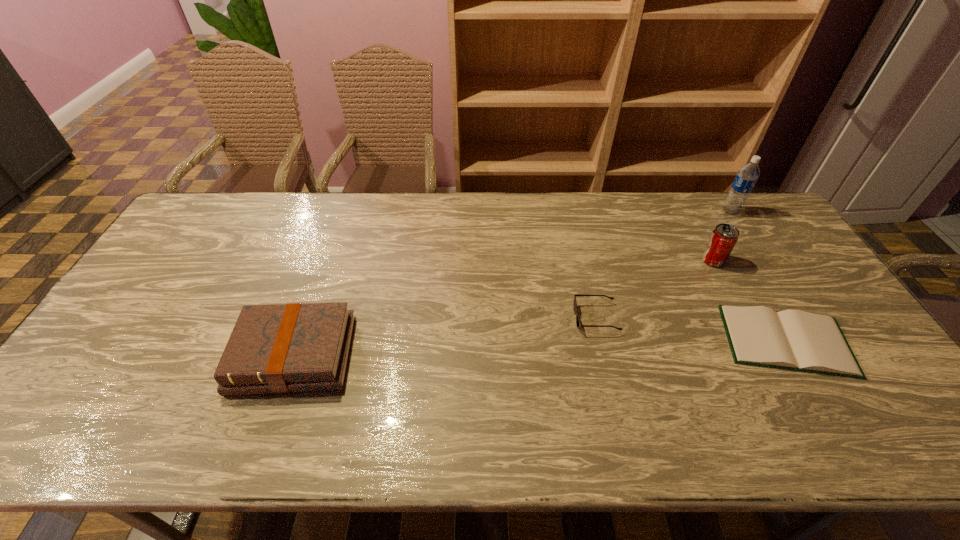
Identify the location of object that is positioned at the far right corner. (746, 178).

The width and height of the screenshot is (960, 540). I want to click on vacant space at the far edge of the desktop, so click(x=393, y=223).

Where is `vacant area at the near edge of the desktop`? vacant area at the near edge of the desktop is located at coordinates (323, 448).

Locate an element on the screen. The height and width of the screenshot is (540, 960). blank space at the left edge of the desktop is located at coordinates (193, 284).

Find the location of `free space at the right edge of the desktop`. free space at the right edge of the desktop is located at coordinates (808, 279).

The width and height of the screenshot is (960, 540). I want to click on vacant area at the near left corner, so click(59, 433).

This screenshot has height=540, width=960. Find the location of `free space that is in between the taller hardback book and the pop soda`. free space that is in between the taller hardback book and the pop soda is located at coordinates (503, 308).

The height and width of the screenshot is (540, 960). Find the location of `vacant area that lies between the shortest object and the third tallest object`. vacant area that lies between the shortest object and the third tallest object is located at coordinates (540, 348).

Find the location of a particular element. empty space that is in between the shorter hardback book and the left hardback book is located at coordinates (540, 348).

What are the coordinates of `empty location between the third shortest object and the second tallest object` in the screenshot? It's located at (503, 308).